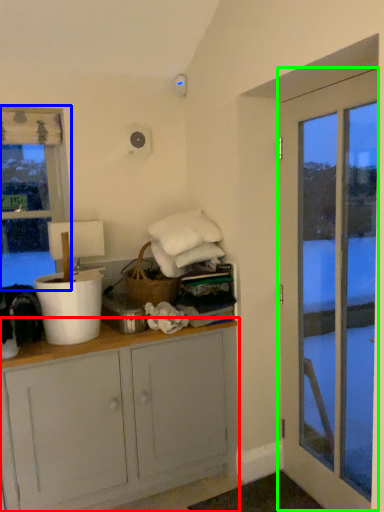
Question: Estimate the real-world distances between objects in this image. Which object is closer to cabinetry (highlighted by a red box), window (highlighted by a blue box) or door (highlighted by a green box)?

Choices:
 (A) window
 (B) door

Answer: (B)